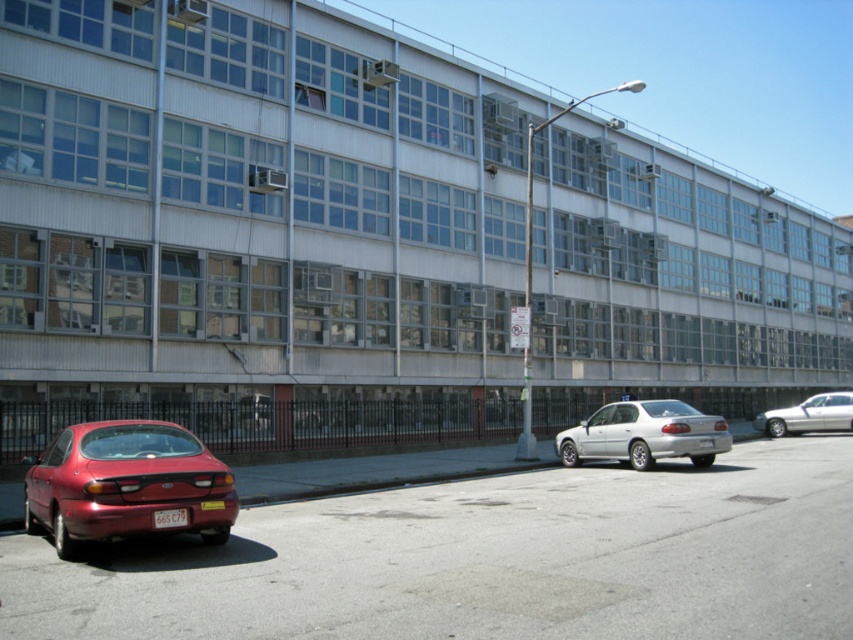
You are a parking attendant who needs to fit a new compact car into the parking spot between the shiny red sedan at lower left and the silver metallic sedan at right. Given that the compact car requires a space of 5 meters in length, can you determine if there is enough space between the two sedans?

The shiny red sedan at lower left is shorter than the silver metallic sedan at right, but the exact length between them isn

You are a delivery driver who needs to park your truck between the shiny red sedan at lower left and the silver metallic sedan at right. Can you fit your truck, which is 2 meters wide, in the space between them?

The shiny red sedan at lower left is above the silver metallic sedan at right, so there is no horizontal space between them for the truck to park. The truck cannot fit between them.